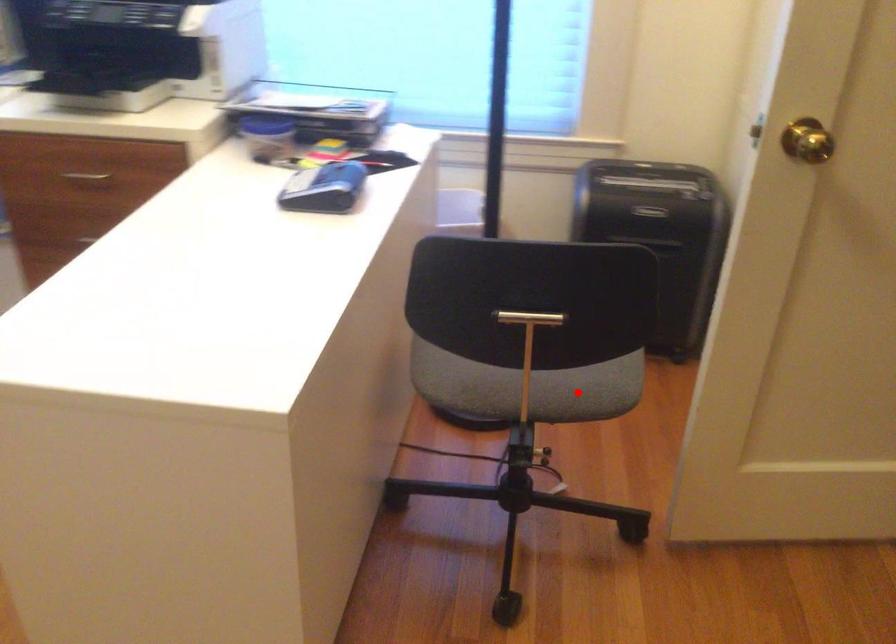
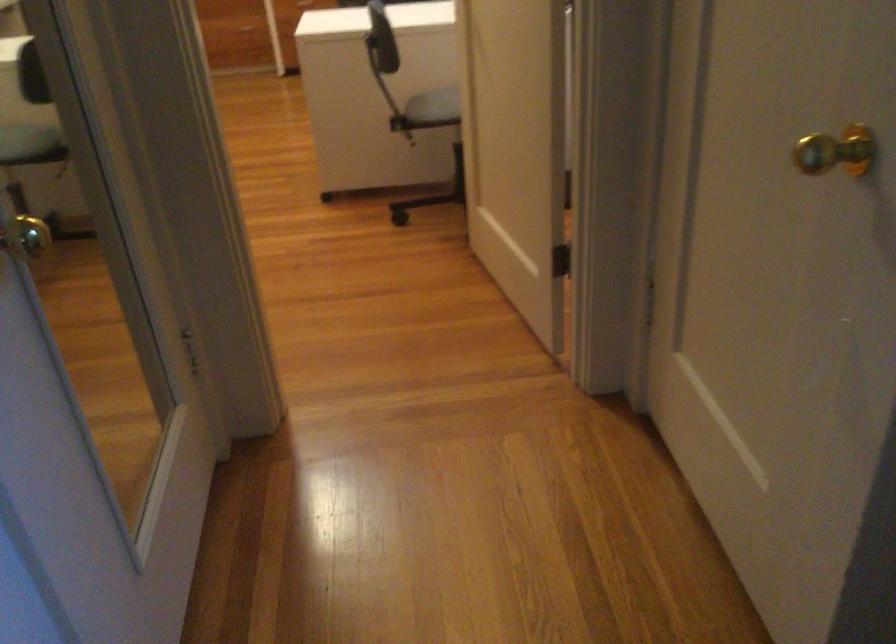
Question: I am providing you with two images of the same scene from different viewpoints. A red point is marked on the first image. Is the red point's position out of view in image 2?

Choices:
 (A) Yes
 (B) No

Answer: (B)